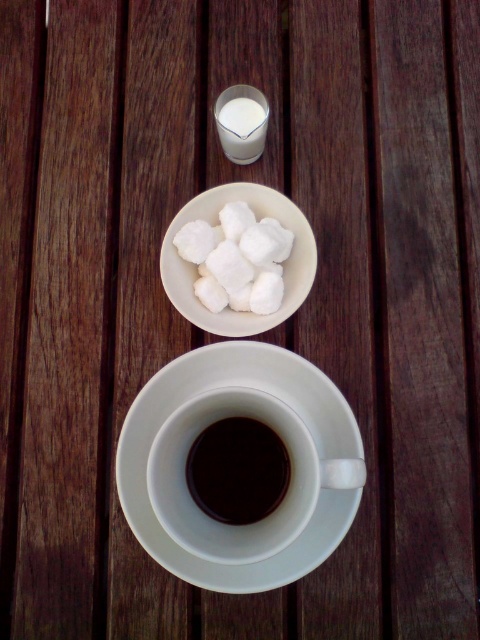
You are looking at the breakfast setup on the wooden table. There are two points marked on the table surface, one at point coordinates point (132, 464) and another at point coordinates point (228, 264). Which of these two points is closer to you?

Point (132, 464) is closer to the camera than point (228, 264), so the point at coordinates point (132, 464) is closer to you.

You are setting up a tea service on the wooden table and need to place the white ceramic saucer at center and the black matte cup at center. According to the image, what is the minimum distance you should keep between them to match the arrangement?

The white ceramic saucer at center is 4.20 centimeters away from the black matte cup at center, so you should keep at least 4.20 centimeters between them to match the arrangement.